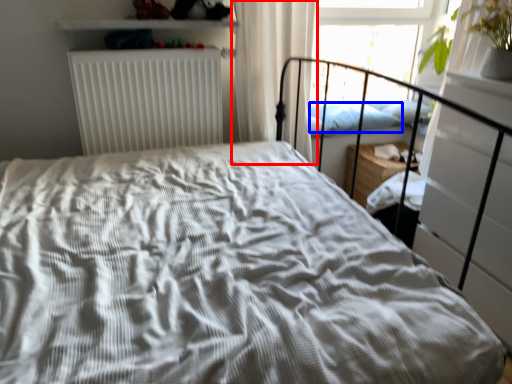
Question: Which point is closer to the camera, curtain (highlighted by a red box) or pillow (highlighted by a blue box)?

Choices:
 (A) curtain
 (B) pillow

Answer: (A)